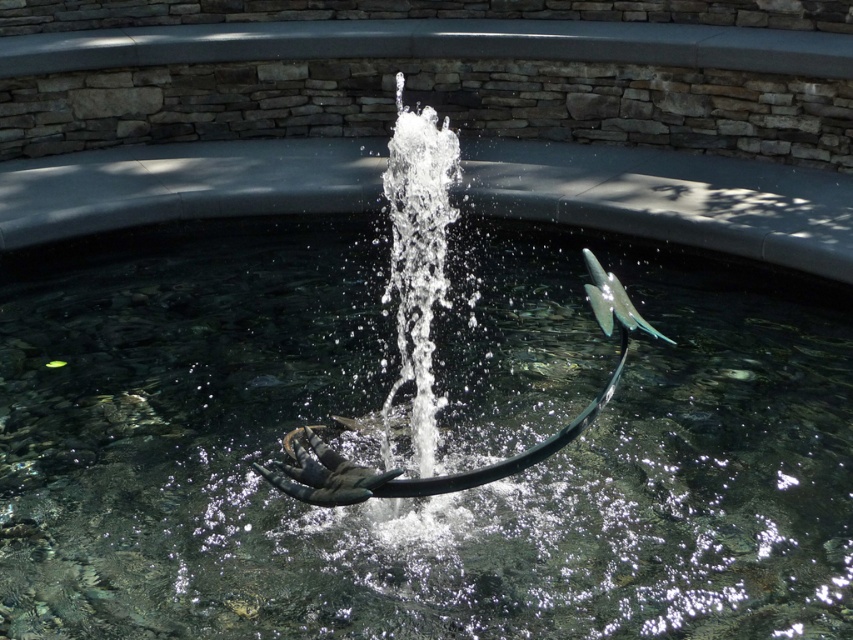
Question: Is clear water at center above metallic silver sculpture at center?

Choices:
 (A) yes
 (B) no

Answer: (B)

Question: Can you confirm if clear water at center is positioned below metallic silver sculpture at center?

Choices:
 (A) no
 (B) yes

Answer: (B)

Question: Where is clear water at center located in relation to metallic silver sculpture at center in the image?

Choices:
 (A) above
 (B) below

Answer: (B)